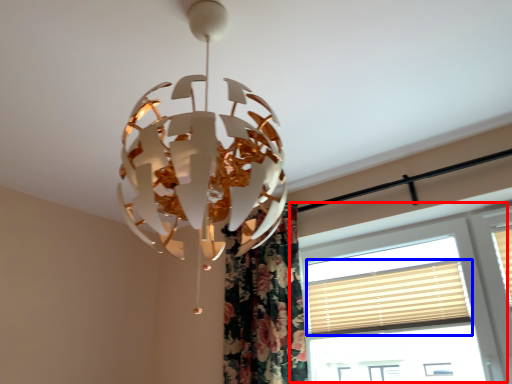
Question: Which object appears closest to the camera in this image, window (highlighted by a red box) or blind (highlighted by a blue box)?

Choices:
 (A) window
 (B) blind

Answer: (A)